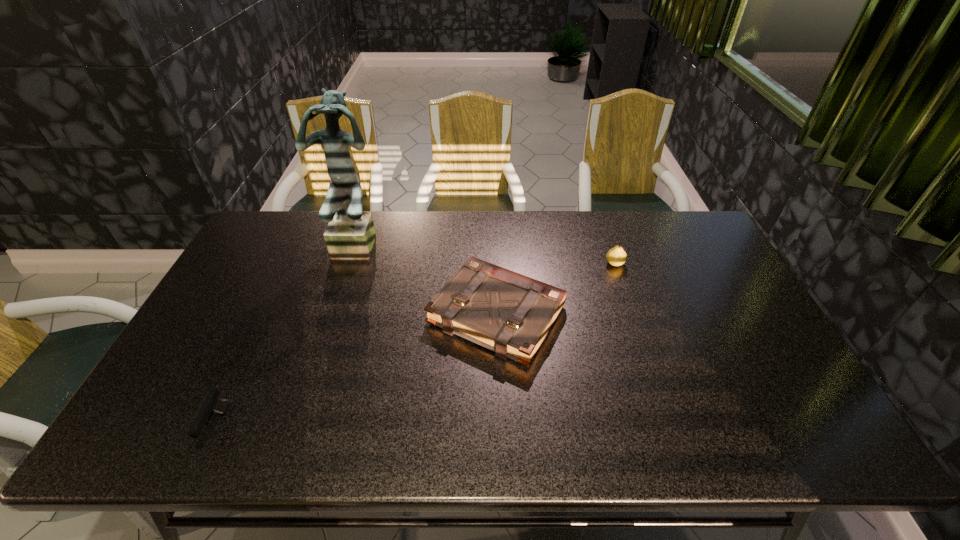
Locate an element on the screen. This screenshot has width=960, height=540. the third object from right to left is located at coordinates (349, 235).

Find the location of a particular element. The height and width of the screenshot is (540, 960). the tallest object is located at coordinates (349, 235).

Find the location of a particular element. This screenshot has width=960, height=540. the rightmost object is located at coordinates (616, 256).

The image size is (960, 540). In order to click on the second object from right to left in this screenshot , I will do `click(509, 313)`.

What are the coordinates of `pistol` in the screenshot? It's located at (212, 404).

Image resolution: width=960 pixels, height=540 pixels. I want to click on the nearest object, so click(212, 404).

I want to click on free space located on the face of the sculpture, so click(x=327, y=349).

At what (x,y) coordinates should I click in order to perform the action: click on vacant space located 0.080m on the back of the rightmost object. Please return your answer as a coordinate pair (x, y). Image resolution: width=960 pixels, height=540 pixels. Looking at the image, I should click on (608, 242).

At what (x,y) coordinates should I click in order to perform the action: click on vacant space located on the left of the third object from left to right. Please return your answer as a coordinate pair (x, y). The image size is (960, 540). Looking at the image, I should click on (409, 314).

The image size is (960, 540). Find the location of `object at the far edge`. object at the far edge is located at coordinates (349, 235).